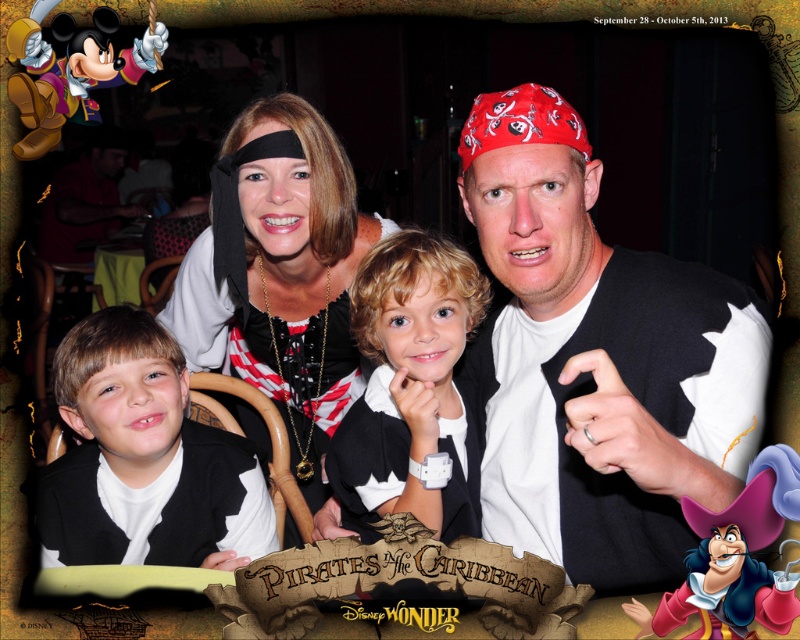
Question: Among these points, which one is farthest from the camera?

Choices:
 (A) (102, 538)
 (B) (446, 241)
 (C) (732, 369)

Answer: (A)

Question: Which point appears farthest from the camera in this image?

Choices:
 (A) (458, 252)
 (B) (556, 420)
 (C) (286, 140)

Answer: (C)

Question: Is white matte vest at center to the right of matte black vest at center from the viewer's perspective?

Choices:
 (A) yes
 (B) no

Answer: (A)

Question: Which of the following is the farthest from the observer?

Choices:
 (A) (708, 317)
 (B) (454, 440)
 (C) (342, 328)
 (D) (96, 509)

Answer: (C)

Question: Is white matte vest at center wider than black matte pirate costume at center?

Choices:
 (A) yes
 (B) no

Answer: (B)

Question: Considering the relative positions of white matte vest at center and white matte shirt at center in the image provided, where is white matte vest at center located with respect to white matte shirt at center?

Choices:
 (A) right
 (B) left

Answer: (A)